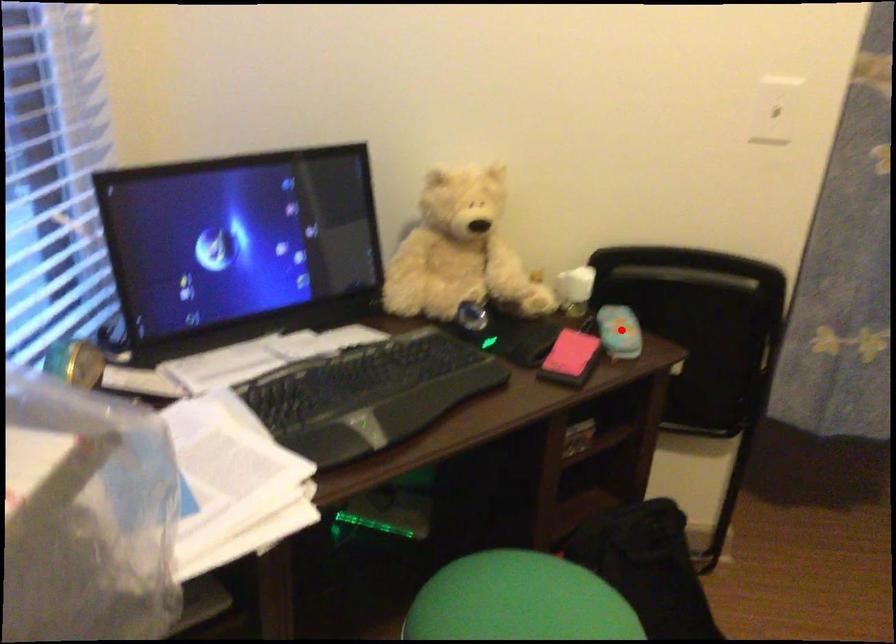
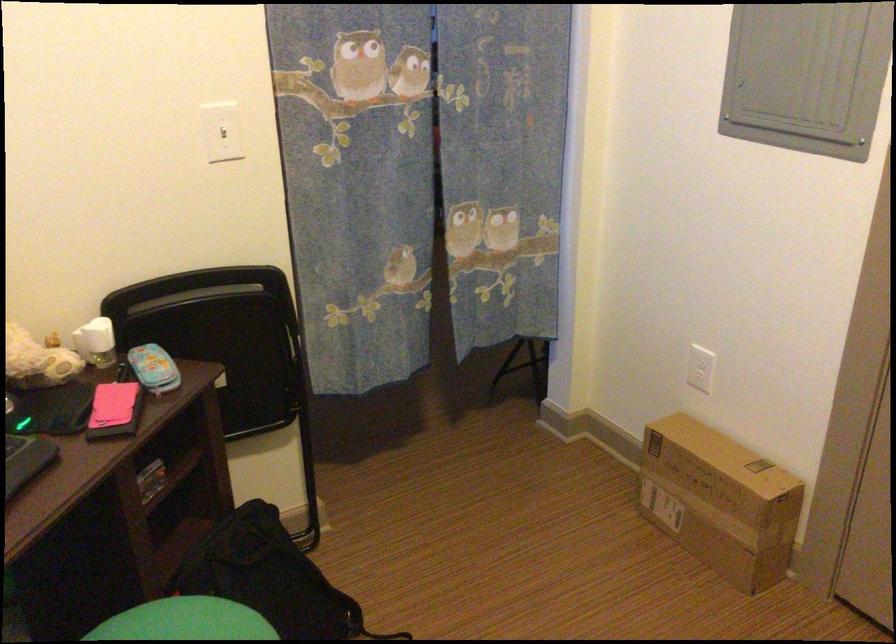
Find the pixel in the second image that matches the highlighted location in the first image.

(153, 368)